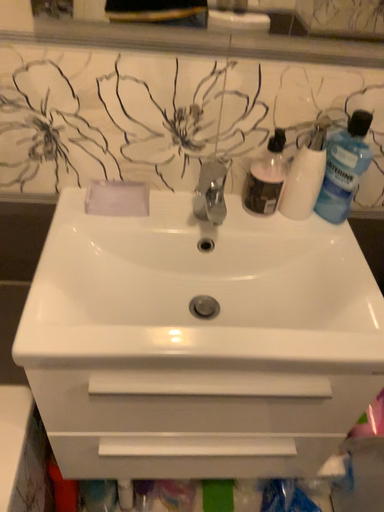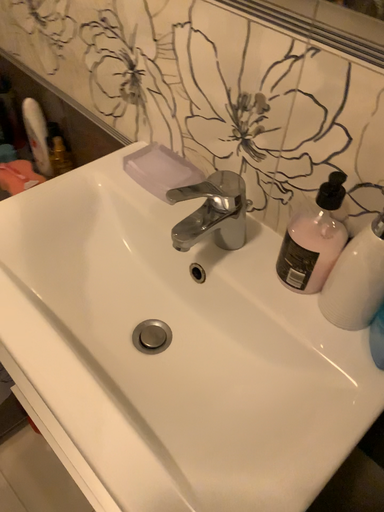
Question: How did the camera likely rotate when shooting the video?

Choices:
 (A) rotated upward
 (B) rotated downward

Answer: (A)